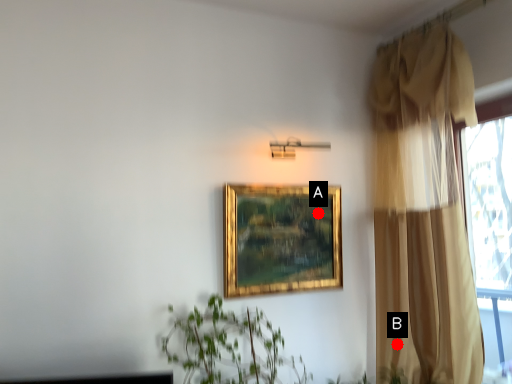
Question: Two points are circled on the image, labeled by A and B beside each circle. Which point is farther from the camera taking this photo?

Choices:
 (A) A is further
 (B) B is further

Answer: (B)